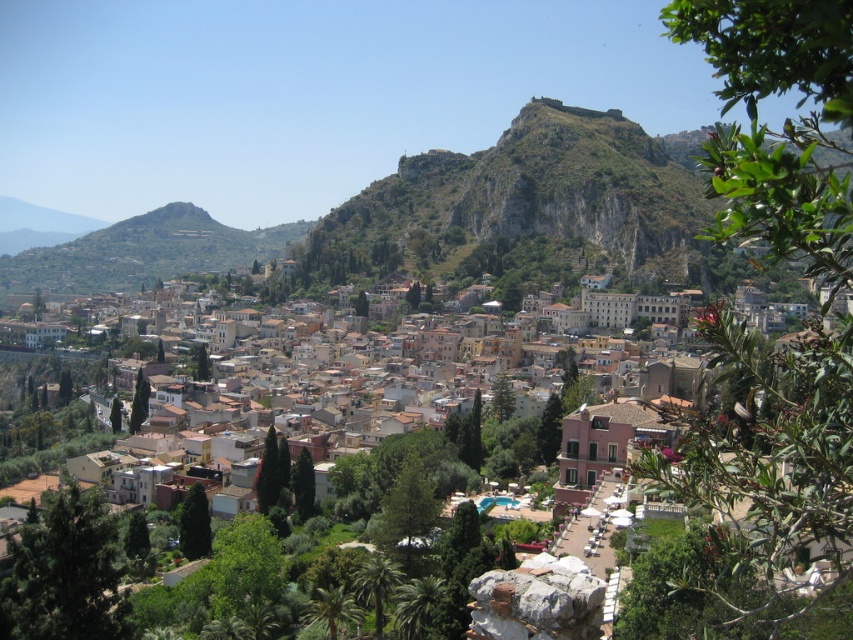
Question: Which point is farther to the camera?

Choices:
 (A) (656, 234)
 (B) (219, 237)

Answer: (B)

Question: Where is green rocky hill at center located in relation to green grassy hillside at center in the image?

Choices:
 (A) above
 (B) below

Answer: (A)

Question: Is green rocky hill at center below green grassy hillside at center?

Choices:
 (A) no
 (B) yes

Answer: (A)

Question: Is green rocky hill at center wider than green grassy hillside at center?

Choices:
 (A) no
 (B) yes

Answer: (A)